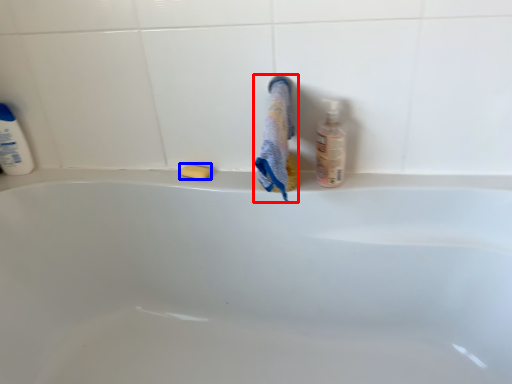
Question: Which object appears farthest to the camera in this image, bath towel (highlighted by a red box) or soap (highlighted by a blue box)?

Choices:
 (A) bath towel
 (B) soap

Answer: (B)